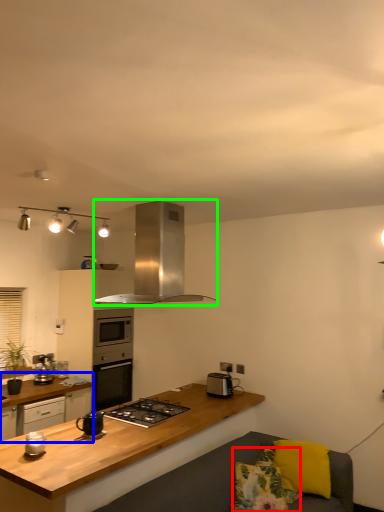
Question: Considering the real-world distances, which object is farthest from pillow (highlighted by a red box)? cabinetry (highlighted by a blue box) or kitchen appliance (highlighted by a green box)?

Choices:
 (A) cabinetry
 (B) kitchen appliance

Answer: (A)